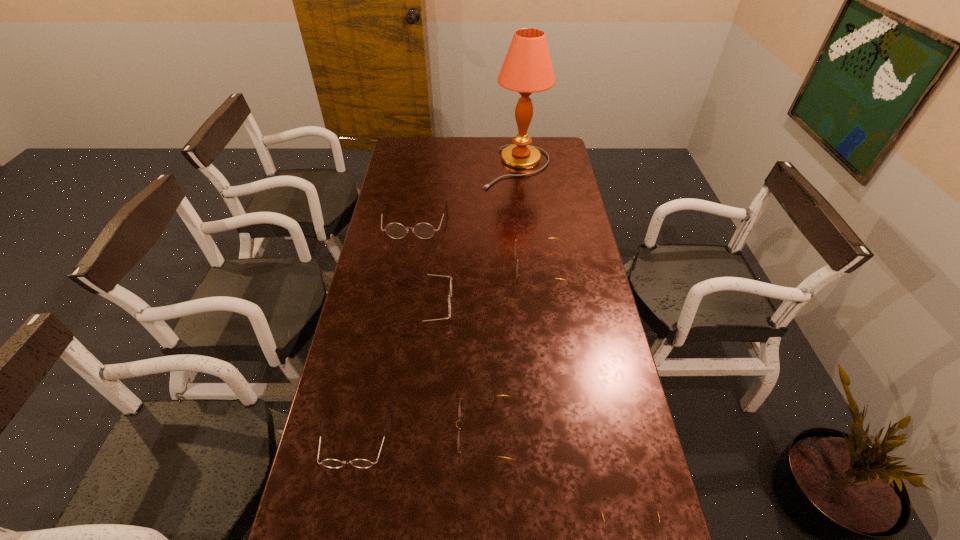
Find the location of a particular element. Image resolution: width=960 pixels, height=540 pixels. free space between the farthest object and the nearest dark spectacles is located at coordinates (436, 302).

This screenshot has width=960, height=540. Identify the location of object that stands as the second closest to the second nearest dark spectacles. (394, 230).

Locate an element on the screen. The width and height of the screenshot is (960, 540). object that stands as the third closest to the second biggest gold spectacles is located at coordinates (449, 300).

Select which spectacles is the third closest to the smallest dark spectacles. Please provide its 2D coordinates. Your answer should be formatted as a tuple, i.e. [(x, y)], where the tuple contains the x and y coordinates of a point satisfying the conditions above.

[(599, 508)]

Identify which spectacles is the second closest to the nearest dark spectacles. Please provide its 2D coordinates. Your answer should be formatted as a tuple, i.e. [(x, y)], where the tuple contains the x and y coordinates of a point satisfying the conditions above.

[(449, 300)]

Where is `the closest dark spectacles relative to the second farthest dark spectacles`? the closest dark spectacles relative to the second farthest dark spectacles is located at coordinates (394, 230).

Identify which dark spectacles is the third closest to the leftmost gold spectacles. Please provide its 2D coordinates. Your answer should be formatted as a tuple, i.e. [(x, y)], where the tuple contains the x and y coordinates of a point satisfying the conditions above.

[(394, 230)]

Identify which gold spectacles is the second closest to the pink lamp. Please provide its 2D coordinates. Your answer should be formatted as a tuple, i.e. [(x, y)], where the tuple contains the x and y coordinates of a point satisfying the conditions above.

[(459, 407)]

This screenshot has width=960, height=540. Identify the location of the closest gold spectacles to the biggest dark spectacles. [515, 245].

The width and height of the screenshot is (960, 540). I want to click on vacant space that satisfies the following two spatial constraints: 1. on the temples of the farthest gold spectacles; 2. through the lenses of the nearest dark spectacles, so click(x=563, y=438).